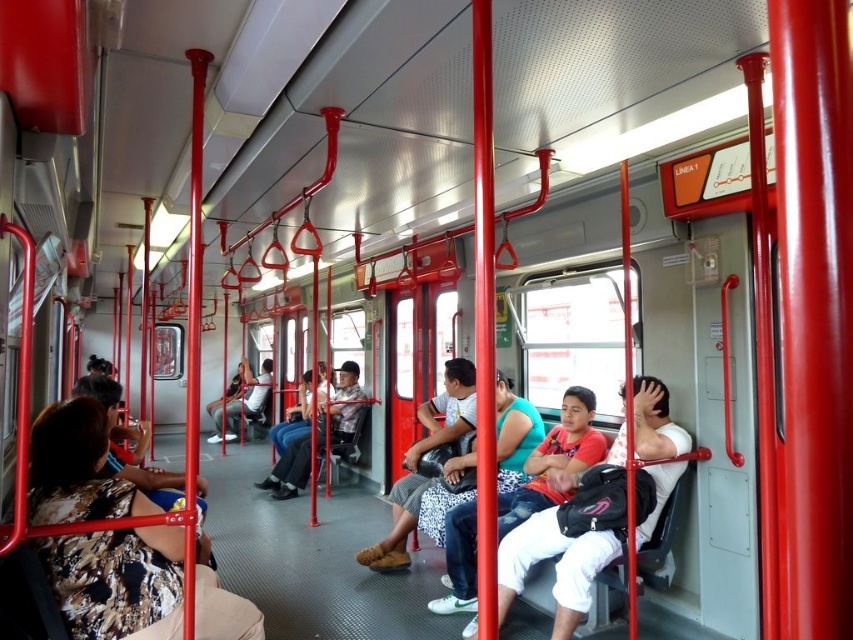
Looking at this image, you are a passenger on this bus and want to know if the matte red shirt at center is wider than the white cotton shirt at center. Can you confirm this based on the scene?

The matte red shirt at center is wider than the white cotton shirt at center according to the description.

You are a passenger on this bus and want to know which shirt is bigger between the matte red shirt at center and the white cotton shirt at center. Can you tell me?

The matte red shirt at center has a larger size compared to the white cotton shirt at center, so the matte red shirt at center is bigger.

You are standing at the entrance of the public bus and notice a passenger wearing a matte red shirt at center. If you want to approach them, which direction should you move relative to your current position?

The matte red shirt at center is located at point (x=555, y=564), so you should move towards the center of the bus to reach them.